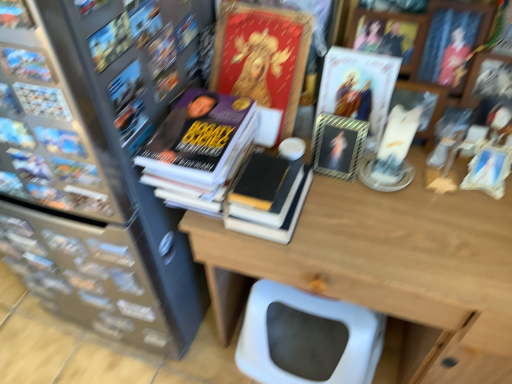
Question: Is metallic silver frame at upper center, the 2th book cover positioned from the right, to the right of wooden table at center from the viewer's perspective?

Choices:
 (A) no
 (B) yes

Answer: (A)

Question: Considering the relative positions of metallic silver frame at upper center, the 2th book cover positioned from the right, and wooden table at center in the image provided, is metallic silver frame at upper center, the 2th book cover positioned from the right, in front of wooden table at center?

Choices:
 (A) yes
 (B) no

Answer: (B)

Question: Considering the relative sizes of metallic silver frame at upper center, the 2th book cover positioned from the right, and wooden table at center in the image provided, is metallic silver frame at upper center, the 2th book cover positioned from the right, bigger than wooden table at center?

Choices:
 (A) yes
 (B) no

Answer: (B)

Question: Does metallic silver frame at upper center, the 2th book cover positioned from the right, have a lesser width compared to wooden table at center?

Choices:
 (A) no
 (B) yes

Answer: (B)

Question: From a real-world perspective, is metallic silver frame at upper center, the 2th book cover positioned from the right, under wooden table at center?

Choices:
 (A) no
 (B) yes

Answer: (A)

Question: From a real-world perspective, is wooden table at center above or below metallic silver frame at upper center, positioned as the 2th book cover in left-to-right order?

Choices:
 (A) below
 (B) above

Answer: (A)

Question: Is point (440, 365) positioned closer to the camera than point (330, 134)?

Choices:
 (A) farther
 (B) closer

Answer: (A)

Question: From the image's perspective, relative to metallic silver frame at upper center, positioned as the 2th book cover in left-to-right order, is wooden table at center above or below?

Choices:
 (A) above
 (B) below

Answer: (B)

Question: In terms of width, does wooden table at center look wider or thinner when compared to metallic silver frame at upper center, positioned as the 2th book cover in left-to-right order?

Choices:
 (A) wide
 (B) thin

Answer: (A)

Question: In terms of width, does metallic gold frame at upper center, the 1th book cover when ordered from right to left, look wider or thinner when compared to wooden table at center?

Choices:
 (A) wide
 (B) thin

Answer: (B)

Question: Visually, is metallic gold frame at upper center, the 1th book cover when ordered from right to left, positioned to the left or to the right of wooden table at center?

Choices:
 (A) left
 (B) right

Answer: (A)

Question: Is point (359, 114) closer or farther from the camera than point (453, 238)?

Choices:
 (A) farther
 (B) closer

Answer: (A)

Question: In terms of size, does metallic gold frame at upper center, which is the 3th book cover from left to right, appear bigger or smaller than wooden table at center?

Choices:
 (A) small
 (B) big

Answer: (A)

Question: Is matte black book at upper left, positioned as the 1th book in front-to-back order, taller or shorter than metallic silver frame at upper center, positioned as the 2th book cover in left-to-right order?

Choices:
 (A) short
 (B) tall

Answer: (A)

Question: From a real-world perspective, is matte black book at upper left, positioned as the 1th book in front-to-back order, positioned above or below metallic silver frame at upper center, positioned as the 2th book cover in left-to-right order?

Choices:
 (A) below
 (B) above

Answer: (B)